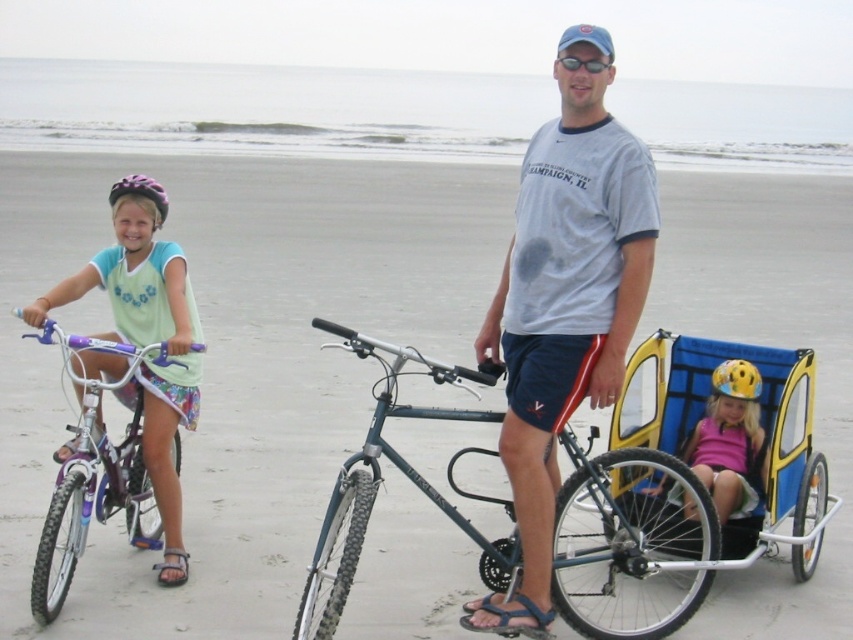
Question: Is pink fabric helmet at center thinner than yellow matte helmet at center?

Choices:
 (A) yes
 (B) no

Answer: (B)

Question: Can you confirm if blue plastic baby carriage at lower right is positioned to the right of pink fabric helmet at center?

Choices:
 (A) yes
 (B) no

Answer: (B)

Question: Estimate the real-world distances between objects in this image. Which object is closer to the gray t-shirt at center?

Choices:
 (A) purple metallic bicycle at left
 (B) purple matte bicycle helmet at upper left
 (C) blue plastic baby carriage at lower right
 (D) metallic blue bicycle at center

Answer: (D)

Question: Which object is closer to the camera taking this photo?

Choices:
 (A) purple metallic bicycle at left
 (B) gray t-shirt at center

Answer: (B)

Question: Estimate the real-world distances between objects in this image. Which object is closer to the purple matte bicycle helmet at upper left?

Choices:
 (A) purple metallic bicycle at left
 (B) pink fabric helmet at center
 (C) metallic blue bicycle at center

Answer: (A)

Question: Does gray t-shirt at center appear over metallic blue bicycle at center?

Choices:
 (A) yes
 (B) no

Answer: (B)